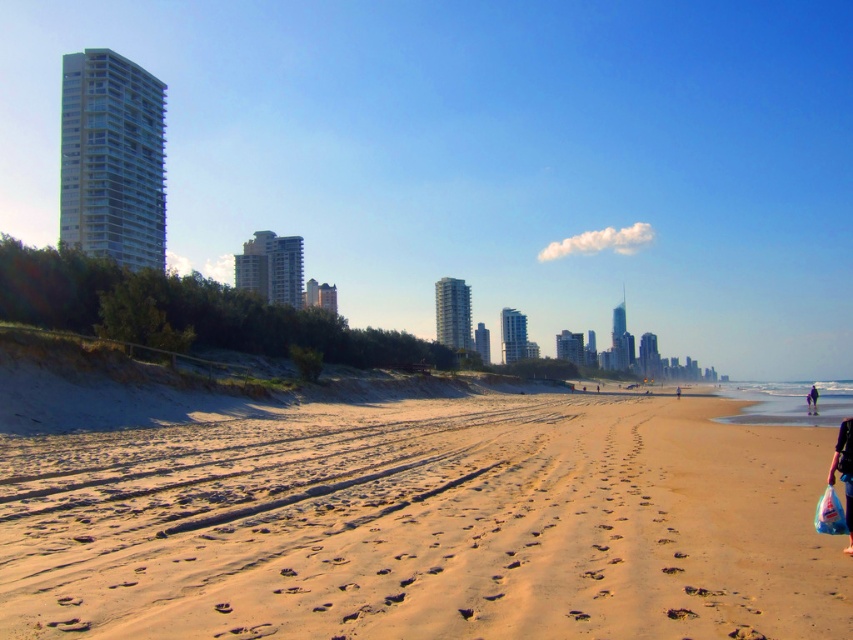
You are a photographer planning to capture a sunset shot at the beach. You have a camera that can only focus on objects within a 10m radius. The sandy beach at lower center and the black fabric person at lower right are both in your view. Can your camera focus on both subjects simultaneously?

The sandy beach at lower center is smaller than the black fabric person at lower right, but the question of whether they are within the 10m radius requires knowing their actual distances. Since the description doesn

You are standing on the beach and want to reach a specific point marked at coordinates point (109, 440). Given that you can walk 3 feet per second, how long will it take you to reach that point?

The distance of point (109, 440) from viewer is 66.02 feet. At a walking speed of 3 feet per second, it would take approximately 22 seconds to reach the point.